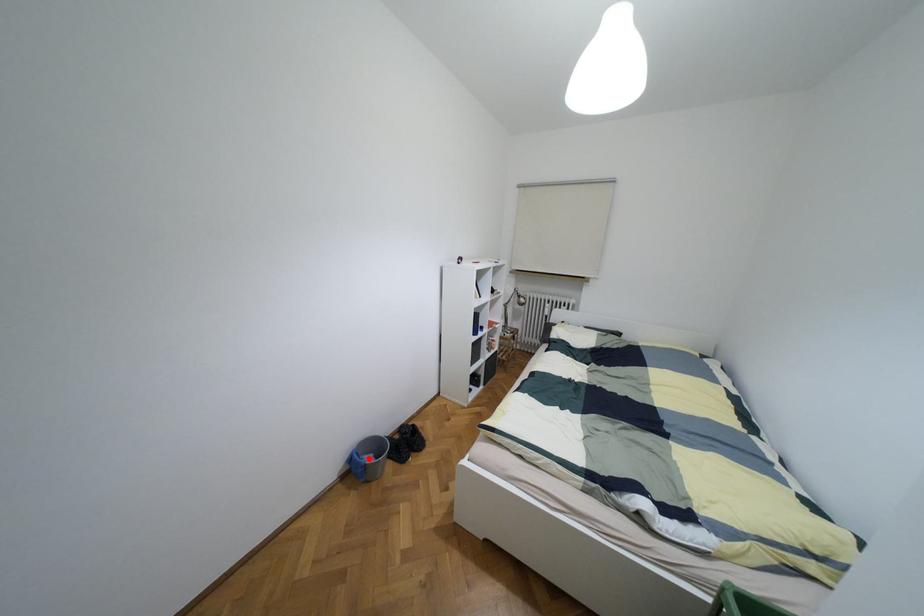
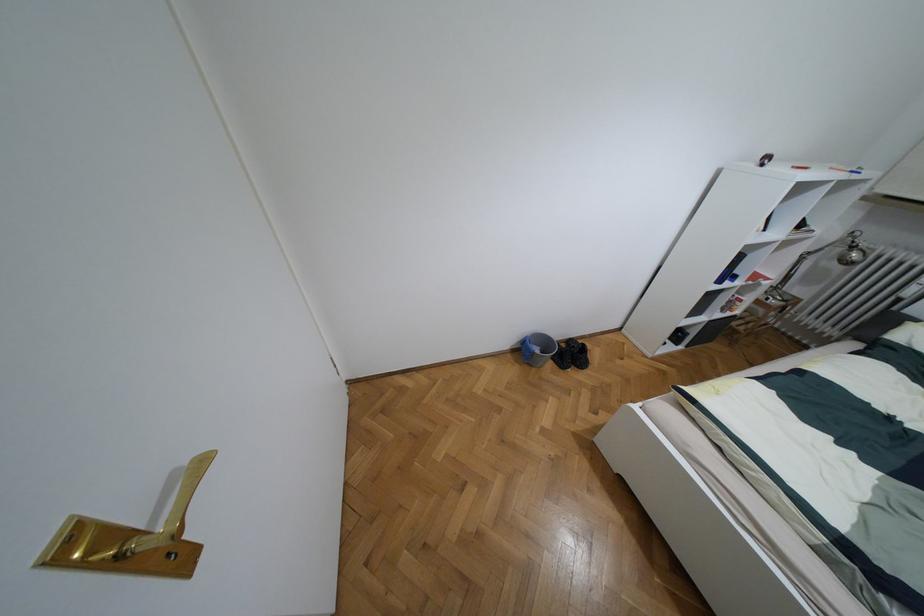
Question: A red point is marked in image1. In image2, is the corresponding 3D point closer to the camera or farther? Reply with the corresponding letter.

Choices:
 (A) The corresponding 3D point is closer.
 (B) The corresponding 3D point is farther.

Answer: (B)